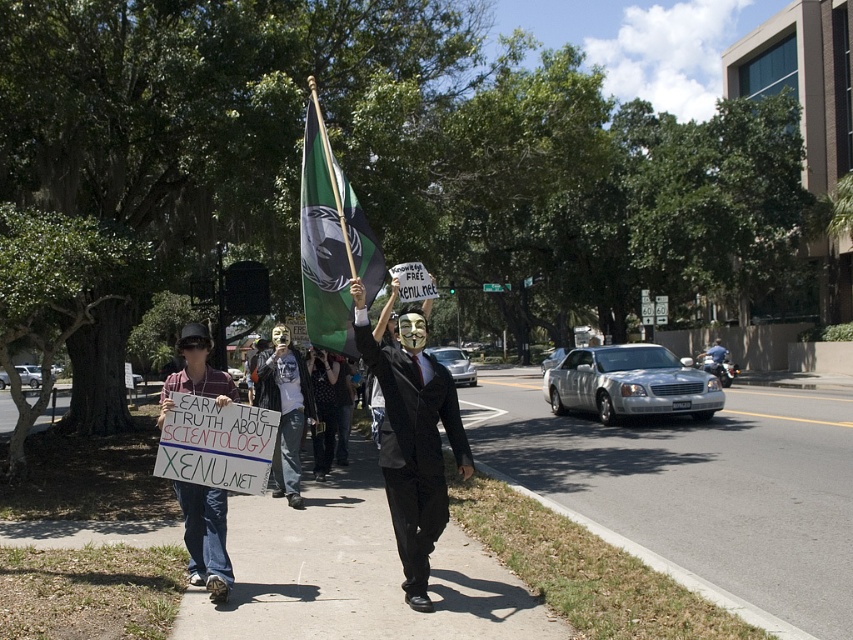
Looking at this image, you are a photographer standing at the edge of the sidewalk in the protest scene. You want to take a photo that includes both the asphalt at lower center and the green fabric flag at center. Given that your camera has a maximum focus range of 8 meters, will you be able to capture both objects in focus without moving your position?

The asphalt at lower center and green fabric flag at center are 8.52 meters apart, which exceeds the camera maximum focus range of 8 meters. Therefore, you cannot capture both objects in focus without moving your position.